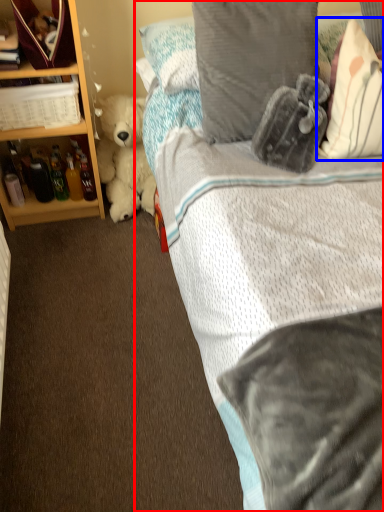
Question: Which point is further to the camera, bed (highlighted by a red box) or pillow (highlighted by a blue box)?

Choices:
 (A) bed
 (B) pillow

Answer: (B)